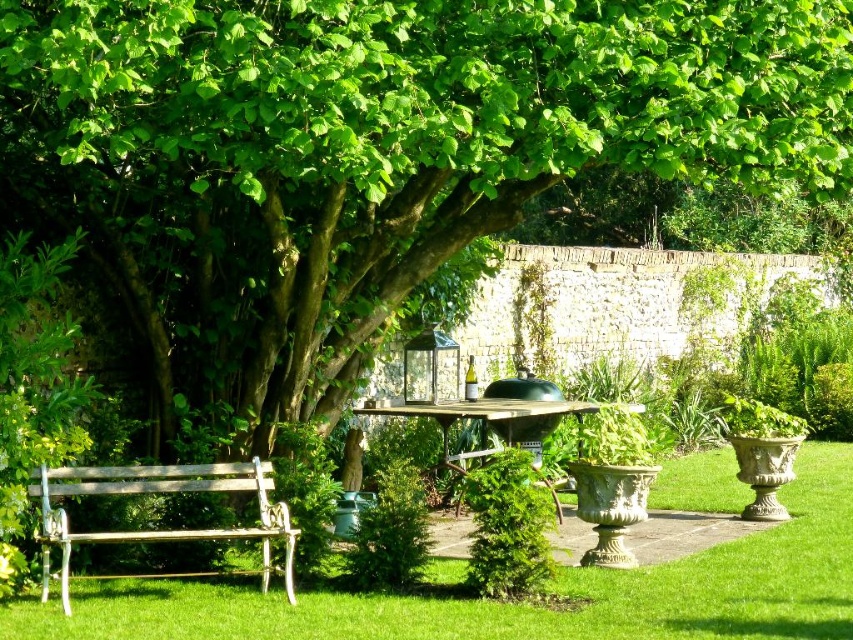
Does green grass at lower center appear under wooden bench at lower left?

Indeed, green grass at lower center is positioned under wooden bench at lower left.

Which is behind, point (627, 605) or point (160, 490)?

The point (160, 490) is more distant.

I want to click on green grass at lower center, so click(524, 604).

Between wooden bench at lower left and smooth wooden table at center, which one is positioned higher?

smooth wooden table at center is above.

Can you confirm if wooden bench at lower left is positioned to the left of smooth wooden table at center?

Yes, wooden bench at lower left is to the left of smooth wooden table at center.

Is point (289, 536) closer to camera compared to point (440, 426)?

Yes, point (289, 536) is closer to viewer.

You are a GUI agent. You are given a task and a screenshot of the screen. Output one action in this format:
    pyautogui.click(x=<x>, y=<y>)
    Task: Click on the wooden bench at lower left
    This screenshot has width=853, height=640.
    Given the screenshot: What is the action you would take?
    pyautogui.click(x=161, y=492)

Is green grass at lower center bigger than smooth wooden table at center?

Indeed, green grass at lower center has a larger size compared to smooth wooden table at center.

Does point (573, 586) come farther from viewer compared to point (456, 470)?

No, (573, 586) is in front of (456, 470).

Is point (270, 605) positioned behind point (431, 406)?

That is False.

In order to click on green grass at lower center in this screenshot , I will do tap(524, 604).